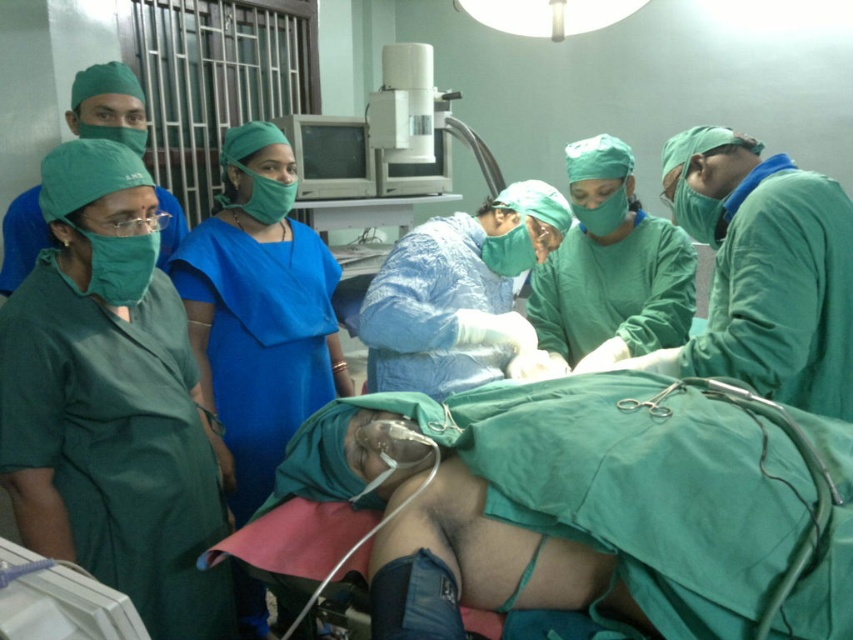
In order to click on green fabric oxygen mask at center in this screenshot , I will do `click(592, 504)`.

The width and height of the screenshot is (853, 640). What do you see at coordinates (592, 504) in the screenshot? I see `green fabric oxygen mask at center` at bounding box center [592, 504].

Who is more forward, (767, 522) or (235, 188)?

Positioned in front is point (767, 522).

Identify the location of green fabric oxygen mask at center. This screenshot has height=640, width=853. (592, 504).

Which is more to the left, green fabric oxygen mask at center or white plastic tube at lower left?

white plastic tube at lower left is more to the left.

Between point (534, 547) and point (27, 586), which one is positioned in front?

Positioned in front is point (27, 586).

Locate an element on the screen. This screenshot has height=640, width=853. green fabric oxygen mask at center is located at coordinates (592, 504).

Can you confirm if blue fabric dress at center is positioned below green smooth surgical gown at center?

Yes.

Between blue fabric dress at center and green smooth surgical gown at center, which one appears on the left side from the viewer's perspective?

blue fabric dress at center is more to the left.

The height and width of the screenshot is (640, 853). What do you see at coordinates (259, 310) in the screenshot?
I see `blue fabric dress at center` at bounding box center [259, 310].

This screenshot has height=640, width=853. Find the location of `blue fabric dress at center`. blue fabric dress at center is located at coordinates (259, 310).